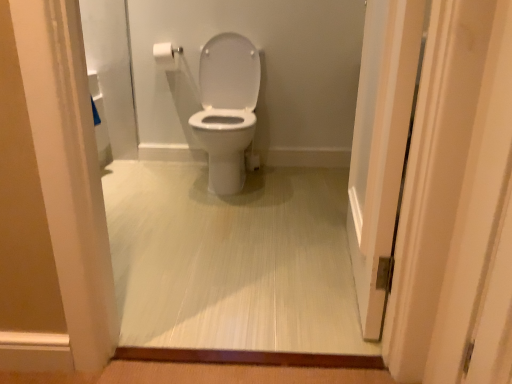
Find the location of a particular element. Image resolution: width=512 pixels, height=384 pixels. vacant region under white glossy door at right (from a real-world perspective) is located at coordinates (350, 265).